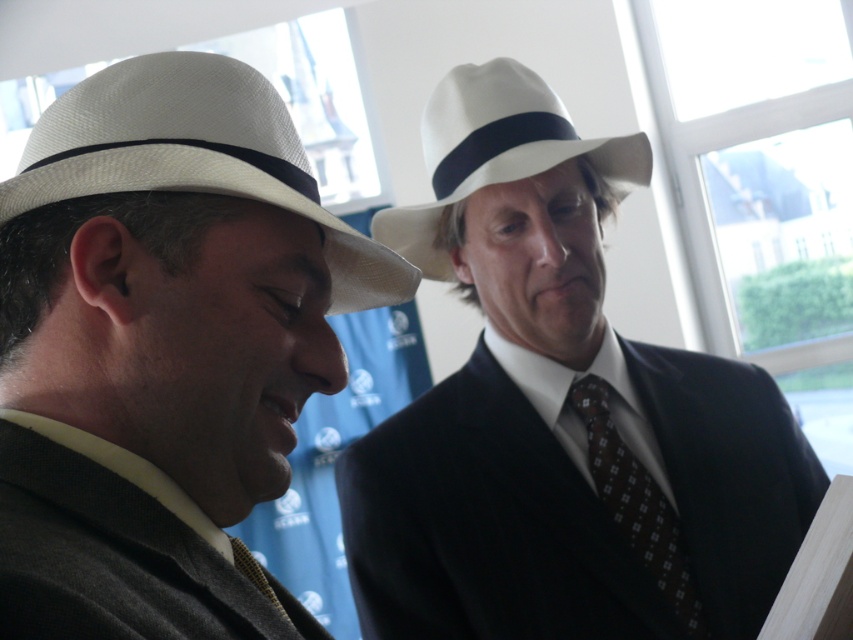
Is dark gray wool suit at lower left positioned in front of brown dotted fabric tie at right?

Yes, it is.

Which is behind, point (281, 616) or point (682, 572)?

Point (682, 572)

Where is `dark gray wool suit at lower left`? The width and height of the screenshot is (853, 640). dark gray wool suit at lower left is located at coordinates (115, 556).

Does white matte fedora at upper center have a greater width compared to dark gray wool suit at lower left?

Correct, the width of white matte fedora at upper center exceeds that of dark gray wool suit at lower left.

The width and height of the screenshot is (853, 640). I want to click on white matte fedora at upper center, so click(561, 416).

Who is more distant from viewer, (444, 483) or (492, 116)?

Positioned behind is point (492, 116).

Locate an element on the screen. The width and height of the screenshot is (853, 640). white matte fedora at upper center is located at coordinates pyautogui.click(x=561, y=416).

Image resolution: width=853 pixels, height=640 pixels. I want to click on white matte fedora at upper center, so tap(561, 416).